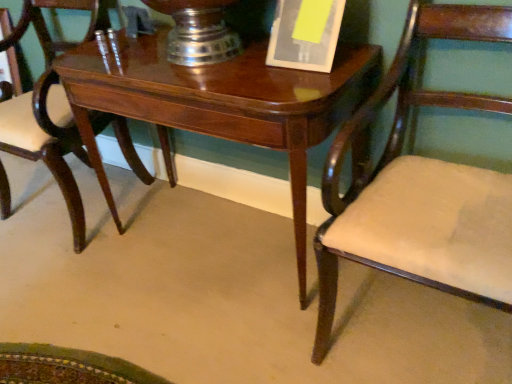
I want to click on vacant space underneath glossy wood table at center (from a real-world perspective), so click(222, 236).